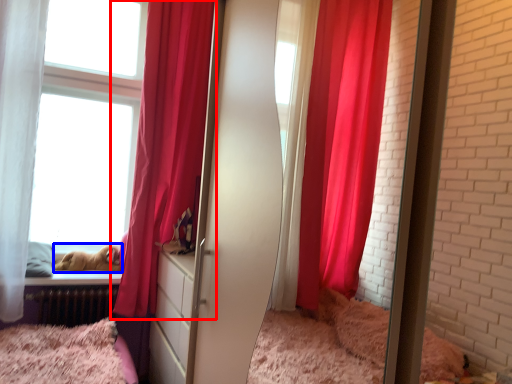
Question: Which point is further to the camera, curtain (highlighted by a red box) or animal (highlighted by a blue box)?

Choices:
 (A) curtain
 (B) animal

Answer: (B)